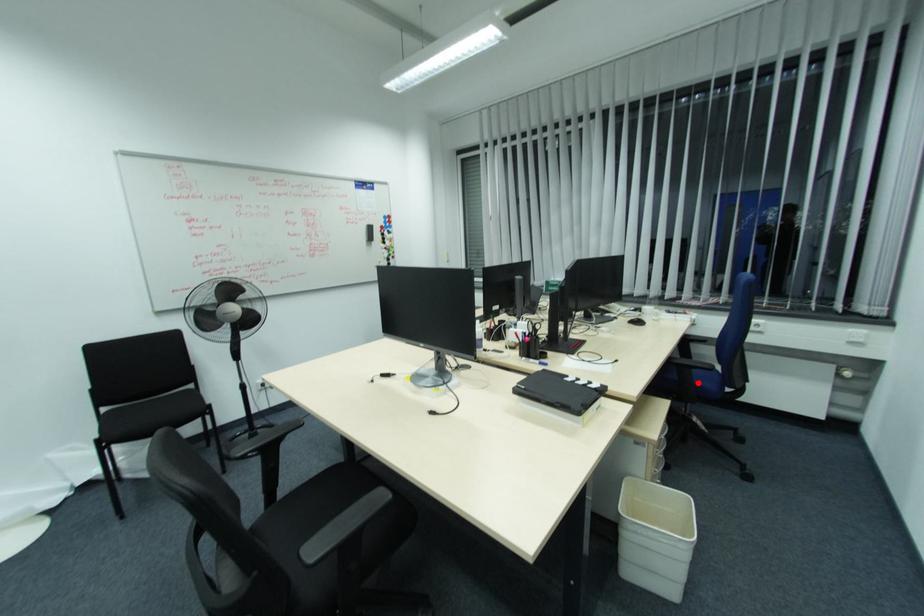
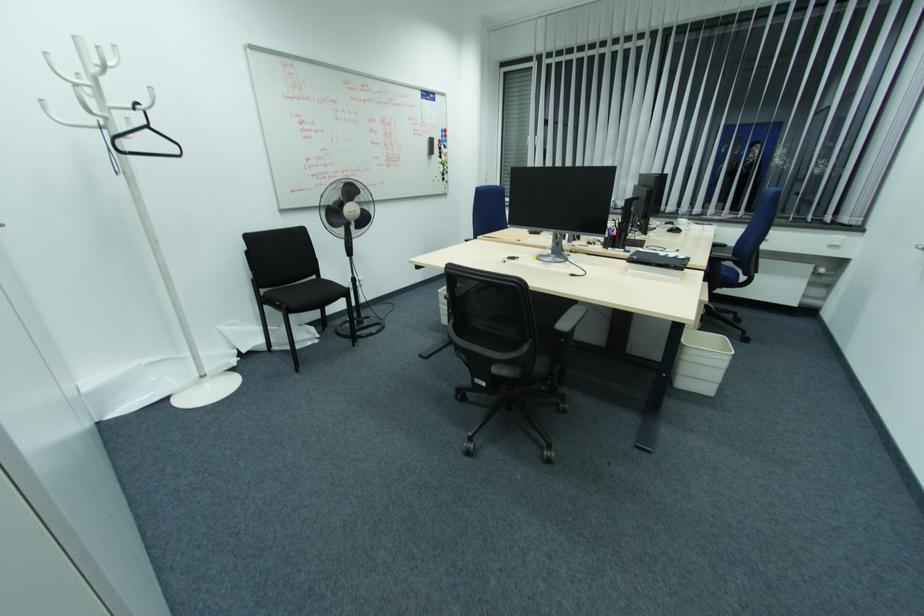
Question: I am providing you with two images of the same scene from different viewpoints. A red point is marked on the first image. At the location where the point appears in image 1, is it still visible in image 2?

Choices:
 (A) Yes
 (B) No

Answer: (A)